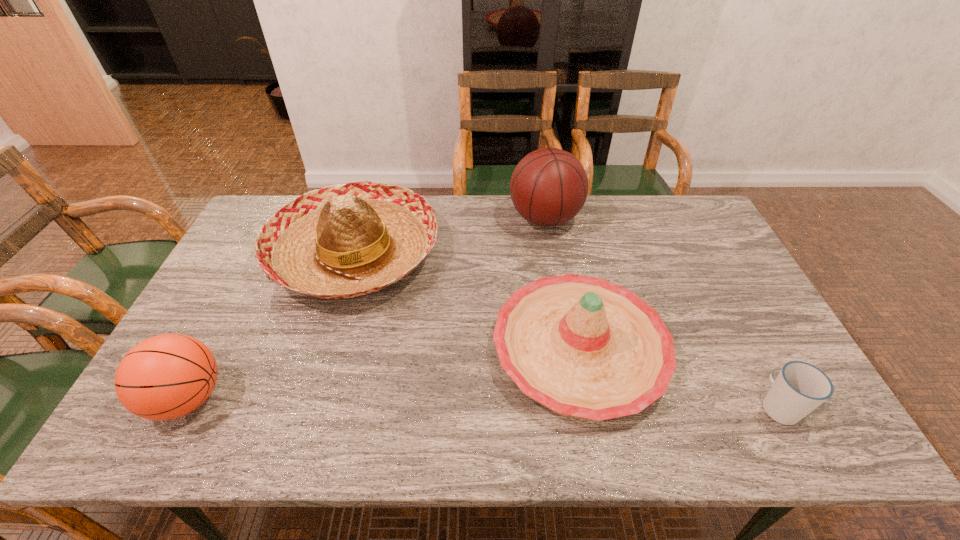
At what (x,y) coordinates should I click in order to perform the action: click on free space at the far left corner of the desktop. Please return your answer as a coordinate pair (x, y). The image size is (960, 540). Looking at the image, I should click on (267, 210).

At what (x,y) coordinates should I click in order to perform the action: click on unoccupied area between the shorter basketball and the tallest object. Please return your answer as a coordinate pair (x, y). This screenshot has width=960, height=540. Looking at the image, I should click on (367, 308).

Image resolution: width=960 pixels, height=540 pixels. Identify the location of free spot between the taller basketball and the shorter basketball. (367, 308).

The image size is (960, 540). In order to click on free space between the right sombrero and the left sombrero in this screenshot , I will do `click(468, 301)`.

In order to click on free space between the nearer basketball and the cup in this screenshot , I will do `click(483, 402)`.

Identify the location of free point between the right basketball and the cup. (661, 313).

Where is `object that stands as the third closest to the nearer basketball`? object that stands as the third closest to the nearer basketball is located at coordinates (549, 186).

Identify which object is the third closest to the left sombrero. Please provide its 2D coordinates. Your answer should be formatted as a tuple, i.e. [(x, y)], where the tuple contains the x and y coordinates of a point satisfying the conditions above.

[(549, 186)]

Where is `blank area in the image that satisfies the following two spatial constraints: 1. on the front side of the right sombrero; 2. on the left side of the left sombrero`? The height and width of the screenshot is (540, 960). blank area in the image that satisfies the following two spatial constraints: 1. on the front side of the right sombrero; 2. on the left side of the left sombrero is located at coordinates (325, 349).

You are a GUI agent. You are given a task and a screenshot of the screen. Output one action in this format:
    pyautogui.click(x=<x>, y=<y>)
    Task: Click on the vacant space that satisfies the following two spatial constraints: 1. on the back side of the left basketball; 2. on the left side of the right sombrero
    
    Given the screenshot: What is the action you would take?
    pyautogui.click(x=213, y=349)